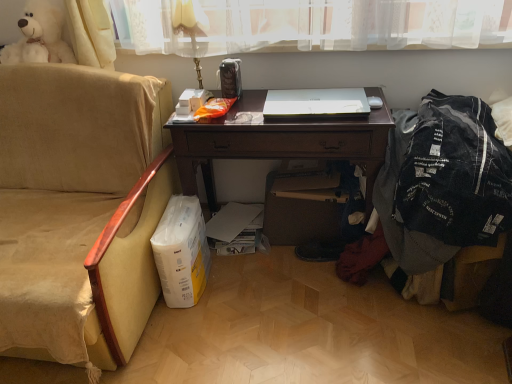
Identify the location of vacant space situated above dark wood desk at center (from a real-world perspective). This screenshot has height=384, width=512. (275, 102).